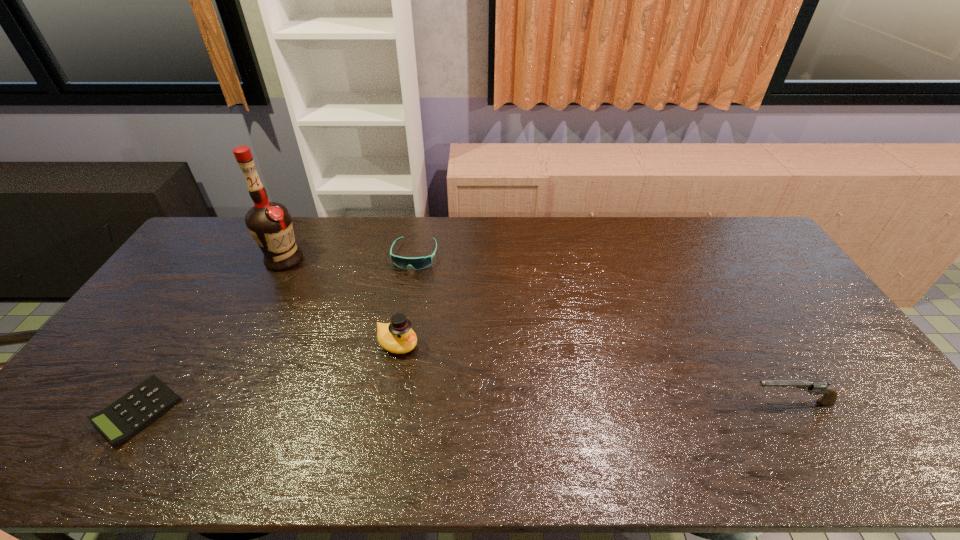
What are the coordinates of `vacant space that satisfies the following two spatial constraints: 1. on the front side of the fourth object from right to left; 2. aiming along the barrel of the rightmost object` in the screenshot? It's located at (210, 402).